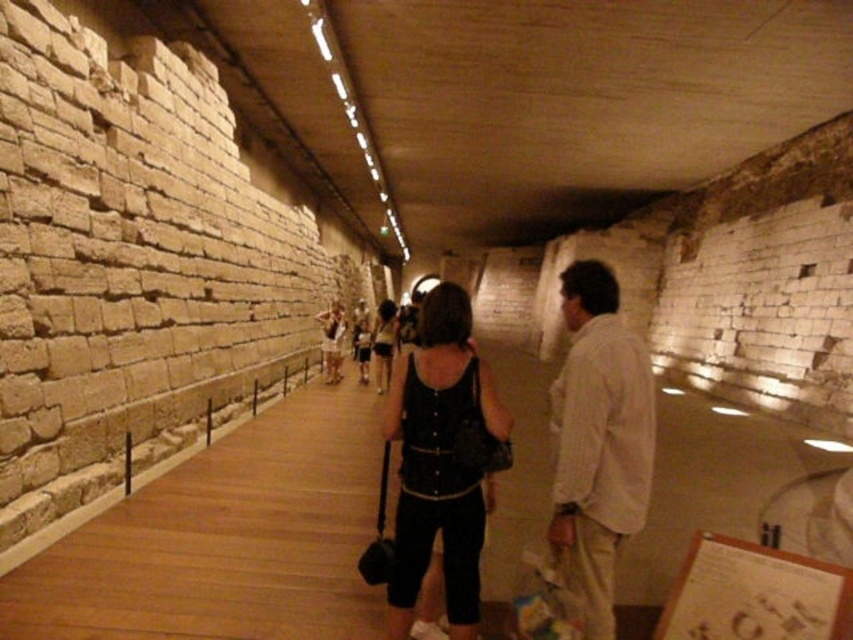
Is point (352, 339) in front of point (386, 369)?

No.

Can you confirm if dark gray fabric dress at center is bigger than matte black tank top at center?

Correct, dark gray fabric dress at center is larger in size than matte black tank top at center.

Is point (374, 324) less distant than point (389, 321)?

No, it is not.

Find the location of a particular element. The width and height of the screenshot is (853, 640). dark gray fabric dress at center is located at coordinates (375, 342).

Does black leather tank top at center have a greater height compared to dark gray fabric dress at center?

Incorrect, black leather tank top at center's height is not larger of dark gray fabric dress at center's.

Which is behind, point (437, 312) or point (389, 324)?

Positioned behind is point (389, 324).

This screenshot has width=853, height=640. Find the location of `black leather tank top at center`. black leather tank top at center is located at coordinates (439, 461).

Can you confirm if black leather tank top at center is shorter than matte black tank top at center?

Incorrect, black leather tank top at center's height does not fall short of matte black tank top at center's.

Locate an element on the screen. The width and height of the screenshot is (853, 640). black leather tank top at center is located at coordinates (439, 461).